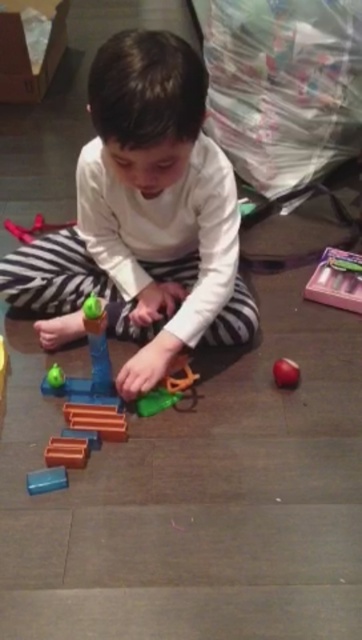
Question: Based on their relative distances, which object is nearer to the blue plastic blocks at center?

Choices:
 (A) translucent orange toy at center
 (B) shiny red apple at lower right

Answer: (A)

Question: Can you confirm if translucent orange toy at center is smaller than rubberized green toy at left?

Choices:
 (A) yes
 (B) no

Answer: (A)

Question: Based on their relative distances, which object is farther from the blue plastic blocks at center?

Choices:
 (A) white matte shirt at center
 (B) translucent orange toy at center
 (C) shiny red apple at lower right

Answer: (C)

Question: Considering the relative positions of pink plastic toy at upper right and shiny red apple at lower right in the image provided, where is pink plastic toy at upper right located with respect to shiny red apple at lower right?

Choices:
 (A) right
 (B) left

Answer: (A)

Question: Can you confirm if pink plastic toy at upper right is bigger than shiny red apple at lower right?

Choices:
 (A) no
 (B) yes

Answer: (B)

Question: Among these objects, which one is nearest to the camera?

Choices:
 (A) rubberized green toy at left
 (B) shiny red apple at lower right

Answer: (B)